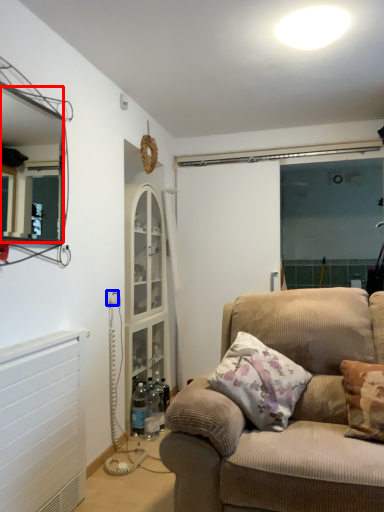
Question: Among these objects, which one is nearest to the camera, mirror (highlighted by a red box) or electric outlet (highlighted by a blue box)?

Choices:
 (A) mirror
 (B) electric outlet

Answer: (A)